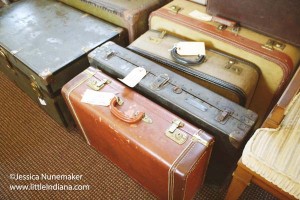
Where is `brown carpet`? The image size is (300, 200). brown carpet is located at coordinates (108, 193).